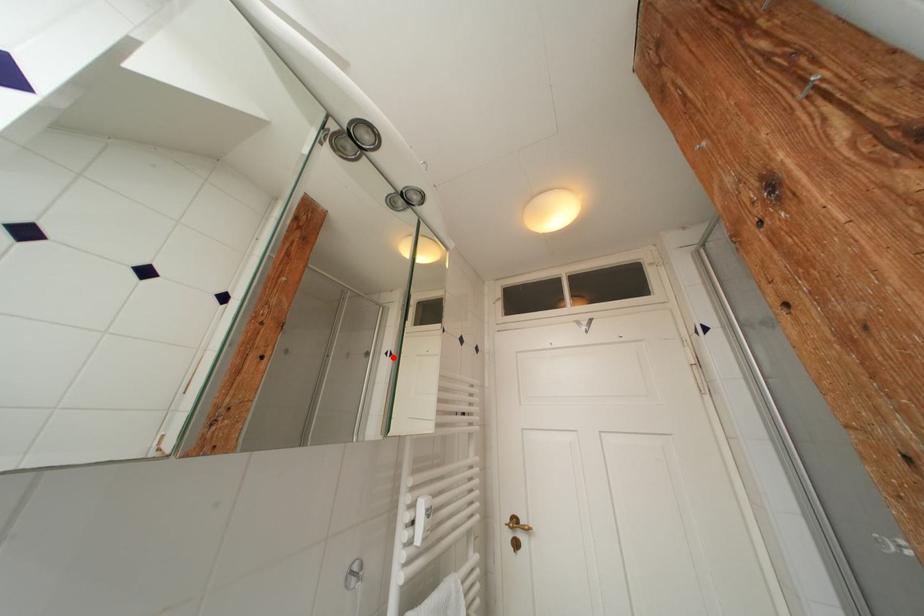
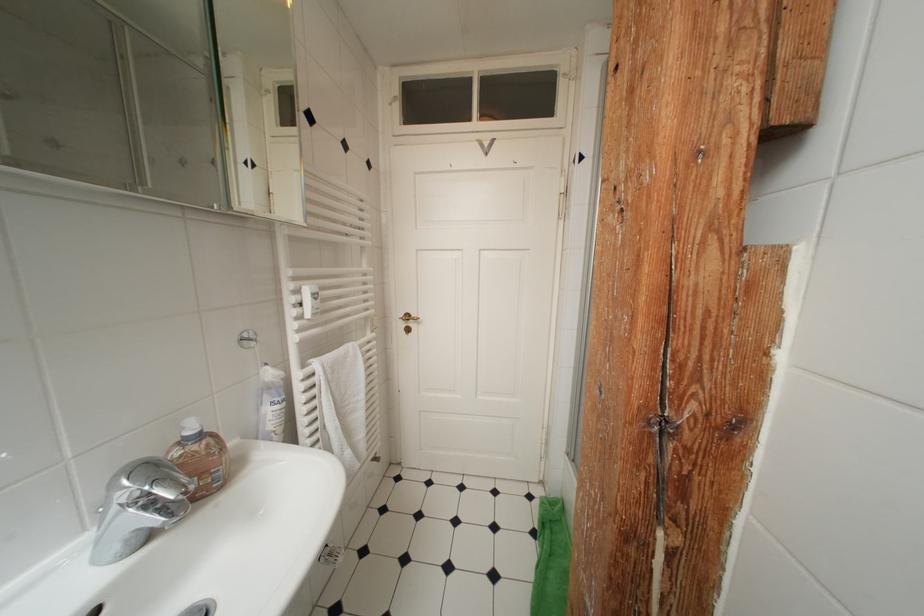
Where in the second image is the point corresponding to the highlighted location from the first image?

(253, 167)